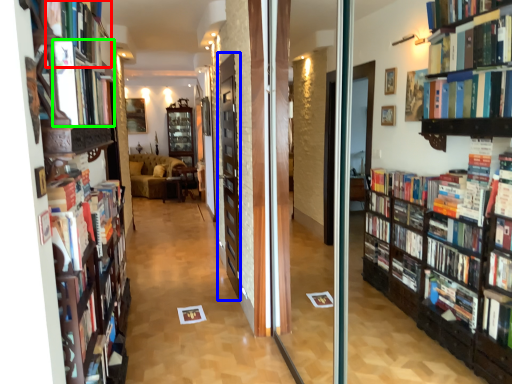
Question: Based on their relative distances, which object is farther from book (highlighted by a red box)? Choose from screen door (highlighted by a blue box) and book (highlighted by a green box).

Choices:
 (A) screen door
 (B) book

Answer: (A)